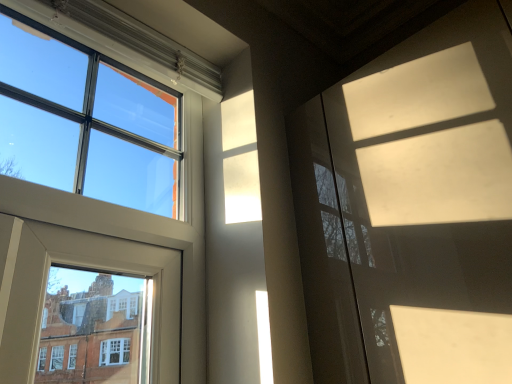
What is the approximate width of clear glass window at upper left?

1.78 inches.

Locate an element on the screen. clear glass window at upper left is located at coordinates coord(87,121).

The image size is (512, 384). Describe the element at coordinates (87, 121) in the screenshot. I see `clear glass window at upper left` at that location.

What is the approximate height of clear glass window at upper left?

It is 18.74 inches.

Find the location of a particular element. Image resolution: width=512 pixels, height=384 pixels. clear glass window at upper left is located at coordinates (87, 121).